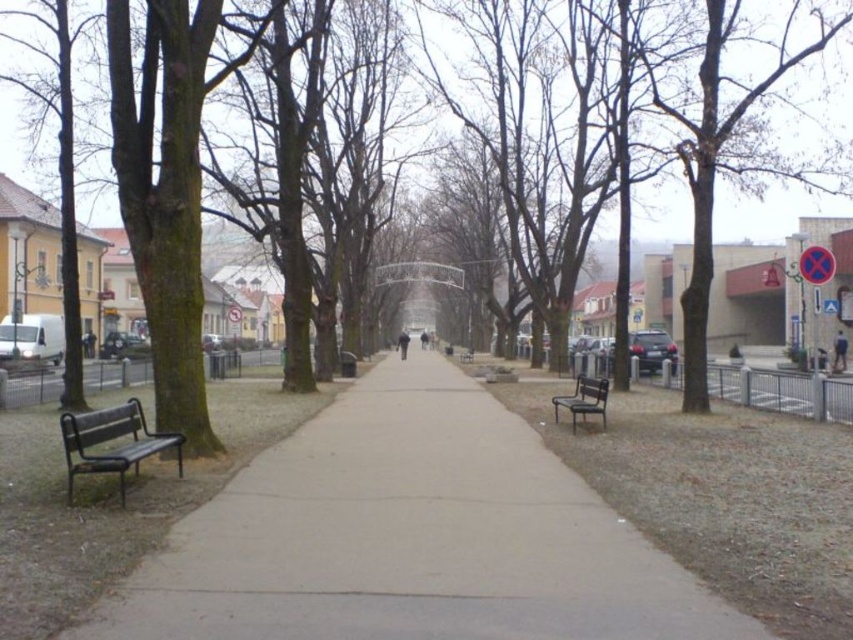
Can you confirm if concrete sidewalk at center is smaller than metallic silver bench at center?

Yes.

Between concrete sidewalk at center and metallic silver bench at center, which one is positioned higher?

metallic silver bench at center

Image resolution: width=853 pixels, height=640 pixels. What do you see at coordinates (410, 536) in the screenshot?
I see `concrete sidewalk at center` at bounding box center [410, 536].

Locate an element on the screen. The image size is (853, 640). concrete sidewalk at center is located at coordinates (410, 536).

What do you see at coordinates (178, 369) in the screenshot? This screenshot has width=853, height=640. I see `brown rough tree at left` at bounding box center [178, 369].

Between point (627, 262) and point (99, 420), which one is positioned behind?

Point (627, 262)

The image size is (853, 640). What do you see at coordinates (178, 369) in the screenshot?
I see `brown rough tree at left` at bounding box center [178, 369].

Where is `brown rough tree at left`? The width and height of the screenshot is (853, 640). brown rough tree at left is located at coordinates (178, 369).

Which is in front, point (192, 241) or point (461, 362)?

Point (192, 241) is in front.

What do you see at coordinates (178, 369) in the screenshot?
I see `brown rough tree at left` at bounding box center [178, 369].

What are the coordinates of `brown rough tree at left` in the screenshot? It's located at (178, 369).